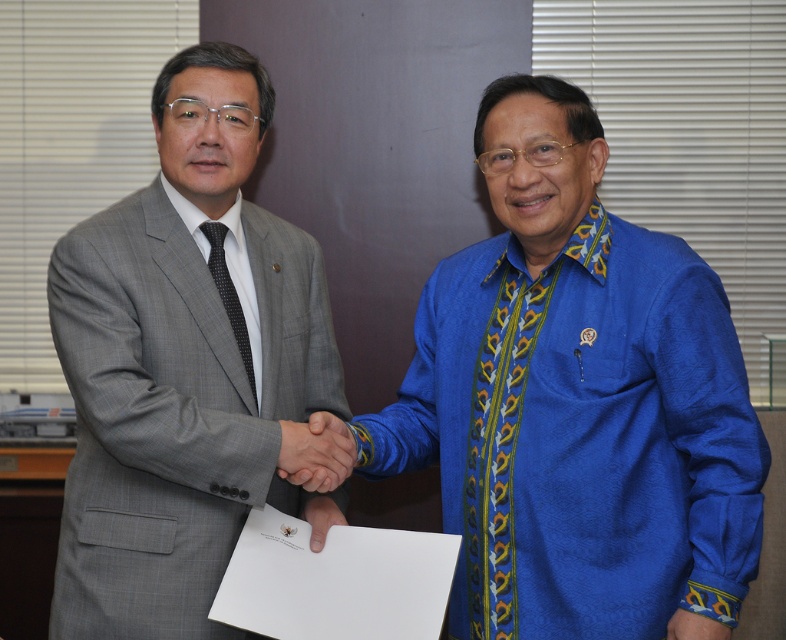
From the picture: Does gray textured suit at left appear on the right side of blue patterned fabric at center?

Incorrect, gray textured suit at left is not on the right side of blue patterned fabric at center.

Where is `gray textured suit at left`? gray textured suit at left is located at coordinates (182, 362).

Find the location of a particular element. The width and height of the screenshot is (786, 640). gray textured suit at left is located at coordinates (182, 362).

Between gray textured suit at left and matte black hands at center, which one is positioned lower?

matte black hands at center is lower down.

Is gray textured suit at left above matte black hands at center?

Yes, gray textured suit at left is above matte black hands at center.

Locate an element on the screen. gray textured suit at left is located at coordinates (182, 362).

Which is behind, point (567, 148) or point (715, 630)?

The point (567, 148) is behind.

Looking at this image, can you confirm if blue silk shirt at center is positioned above blue patterned fabric at center?

Correct, blue silk shirt at center is located above blue patterned fabric at center.

Locate an element on the screen. The width and height of the screenshot is (786, 640). blue silk shirt at center is located at coordinates (575, 401).

Where is `blue silk shirt at center`? The width and height of the screenshot is (786, 640). blue silk shirt at center is located at coordinates (575, 401).